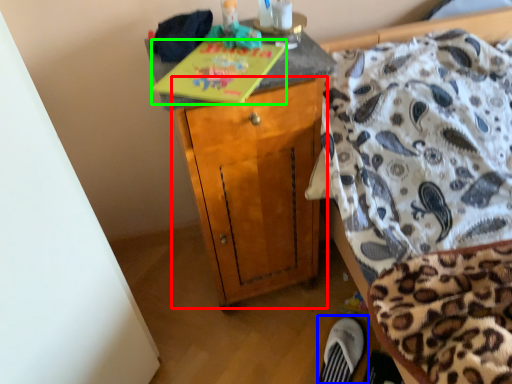
Question: Based on their relative distances, which object is nearer to cabinetry (highlighted by a red box)? Choose from footwear (highlighted by a blue box) and book (highlighted by a green box).

Choices:
 (A) footwear
 (B) book

Answer: (B)